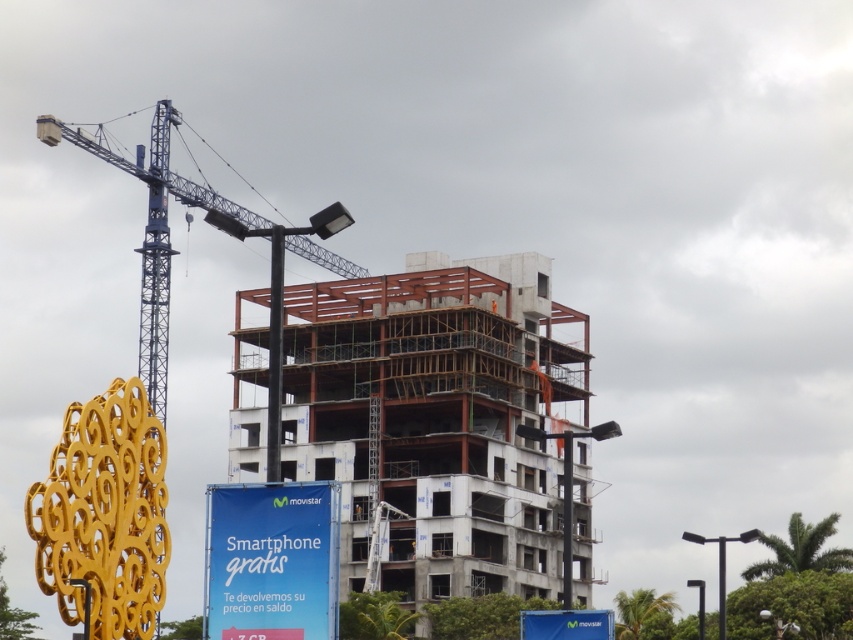
Question: Which object is the farthest from the blue metallic crane at upper left?

Choices:
 (A) blue fabric sign at lower center
 (B) white concrete building at center

Answer: (A)

Question: Which point is closer to the camera?

Choices:
 (A) (277, 632)
 (B) (102, 147)
 (C) (515, 589)

Answer: (A)

Question: Which point is closer to the camera?

Choices:
 (A) blue metallic crane at upper left
 (B) blue fabric sign at lower center
 (C) white concrete building at center

Answer: (A)

Question: Where is white concrete building at center located in relation to blue metallic crane at upper left in the image?

Choices:
 (A) above
 (B) below

Answer: (B)

Question: Does white concrete building at center appear over blue fabric sign at lower center?

Choices:
 (A) yes
 (B) no

Answer: (B)

Question: Can you confirm if white concrete building at center is bigger than blue metallic crane at upper left?

Choices:
 (A) yes
 (B) no

Answer: (B)